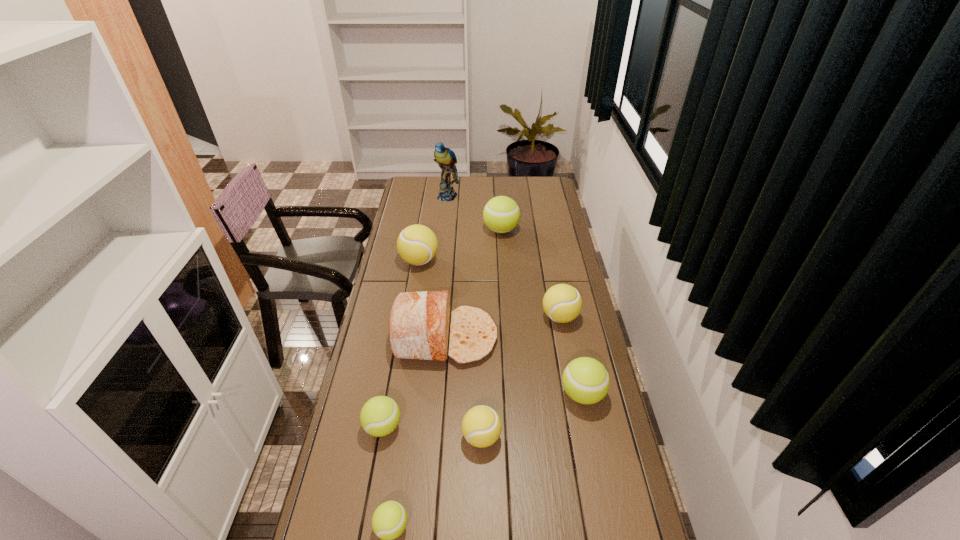
Where is `tennis ball that stands as the closest to the nearest tennis ball`? tennis ball that stands as the closest to the nearest tennis ball is located at coordinates (380, 415).

This screenshot has height=540, width=960. I want to click on yellow tennis ball that is the second closest to the parrot, so click(562, 303).

Select which yellow tennis ball appears as the closest to the bread. Please provide its 2D coordinates. Your answer should be formatted as a tuple, i.e. [(x, y)], where the tuple contains the x and y coordinates of a point satisfying the conditions above.

[(562, 303)]

Identify the location of the second closest green tennis ball to the nearest object. (585, 380).

Where is `the closest green tennis ball to the shortest object`? the closest green tennis ball to the shortest object is located at coordinates (380, 415).

Identify the location of free space that satisfies the following two spatial constraints: 1. on the back side of the farthest yellow tennis ball; 2. on the left side of the third green tennis ball from left to right. (424, 230).

The height and width of the screenshot is (540, 960). I want to click on vacant space that satisfies the following two spatial constraints: 1. on the back side of the biggest yellow tennis ball; 2. on the left side of the second smallest green tennis ball, so click(413, 261).

The image size is (960, 540). In order to click on free spot that satisfies the following two spatial constraints: 1. at the sliced end of the bread; 2. on the right side of the third smallest green tennis ball in this screenshot , I will do 441,394.